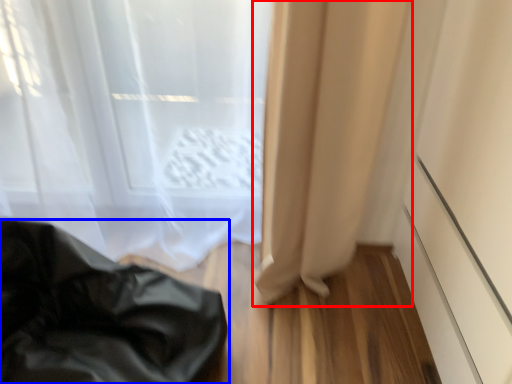
Question: Which point is closer to the camera, curtain (highlighted by a red box) or furniture (highlighted by a blue box)?

Choices:
 (A) curtain
 (B) furniture

Answer: (B)